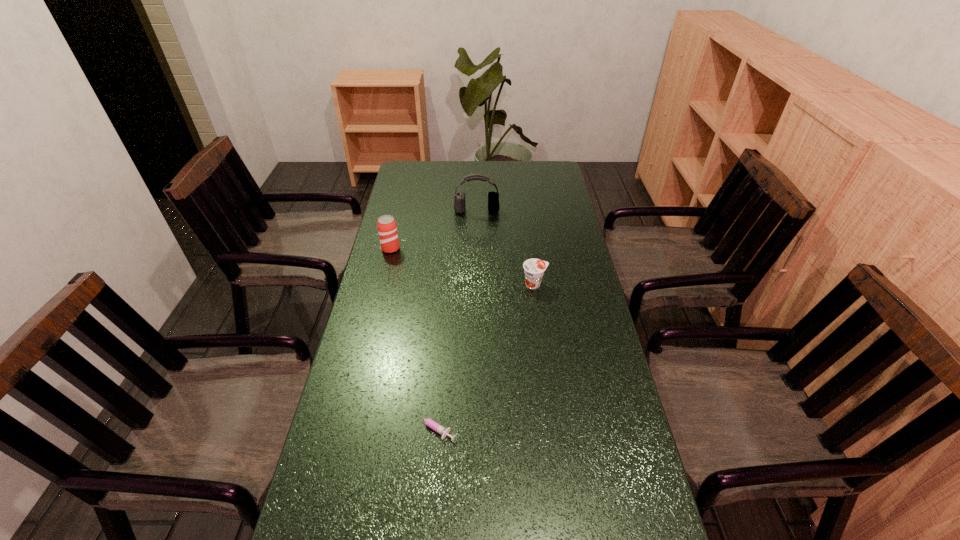
Image resolution: width=960 pixels, height=540 pixels. In order to click on the tallest object in this screenshot , I will do `click(459, 197)`.

The image size is (960, 540). Find the location of `the farthest object`. the farthest object is located at coordinates (459, 197).

Locate an element on the screen. This screenshot has height=540, width=960. beer can is located at coordinates (387, 229).

Locate an element on the screen. the second farthest object is located at coordinates (387, 229).

Locate an element on the screen. This screenshot has width=960, height=540. yogurt is located at coordinates (534, 269).

Where is `the second shortest object`? the second shortest object is located at coordinates (534, 269).

Locate an element on the screen. the shortest object is located at coordinates (435, 426).

Identify the location of the nearest object. The image size is (960, 540). (435, 426).

Identify the location of vacant position located 0.330m on the headband of the farthest object. The height and width of the screenshot is (540, 960). (476, 268).

Locate an element on the screen. vacant region located 0.390m on the back of the leftmost object is located at coordinates (405, 188).